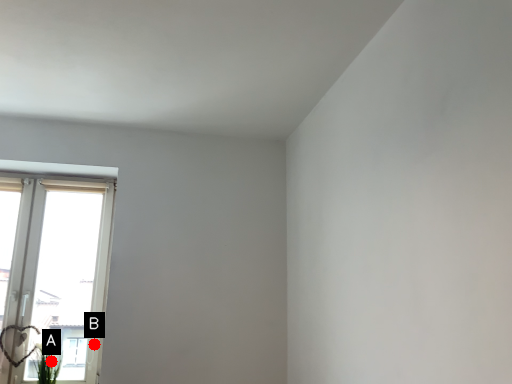
Question: Two points are circled on the image, labeled by A and B beside each circle. Which of the following is the farthest from the observer?

Choices:
 (A) A is further
 (B) B is further

Answer: (B)